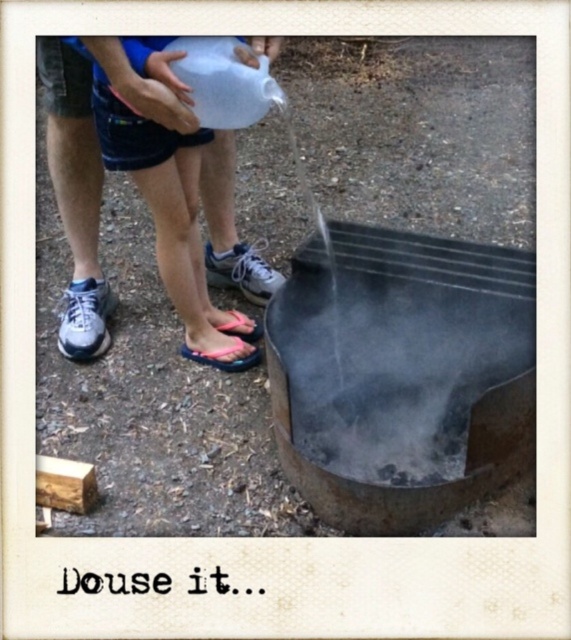
Is rusty metal fire pit at lower center to the right of blue denim shorts at left from the viewer's perspective?

Correct, you'll find rusty metal fire pit at lower center to the right of blue denim shorts at left.

Locate an element on the screen. rusty metal fire pit at lower center is located at coordinates (401, 374).

From the picture: Who is more forward, (436,243) or (215,355)?

Positioned in front is point (436,243).

Where is `rusty metal fire pit at lower center`? The height and width of the screenshot is (640, 571). rusty metal fire pit at lower center is located at coordinates (401, 374).